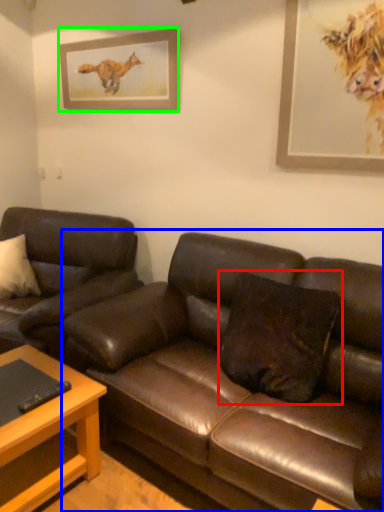
Question: Based on their relative distances, which object is nearer to pillow (highlighted by a red box)? Choose from studio couch (highlighted by a blue box) and picture frame (highlighted by a green box).

Choices:
 (A) studio couch
 (B) picture frame

Answer: (A)